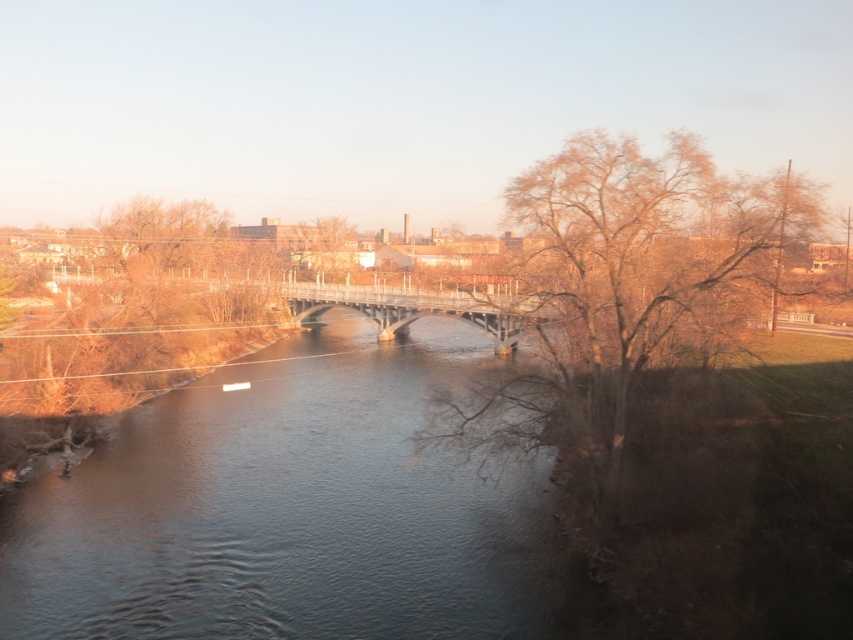
You are standing at the riverside and want to cross to the other side. The point at coordinates (415, 308) marks the location of the concrete gray bridge at center. Is the bridge at that point the best option to cross the river?

Yes, the point at coordinates (415, 308) indicates the concrete gray bridge at center, which is a sturdy structure designed for crossing rivers. Therefore, it is the best option to cross the river safely.

You are a bird flying over the riverside scene. You want to land on the tallest object between the concrete gray bridge at center and the brown leafless tree at center. Which object should you choose?

The brown leafless tree at center is taller than the concrete gray bridge at center, so you should land on the brown leafless tree at center.

You are standing on the concrete bridge and looking towards the brown leafless tree at right and the brown leafless tree at center. Which tree would appear larger in your field of view?

The brown leafless tree at right would appear larger in your field of view because it is closer to the viewer compared to the brown leafless tree at center.